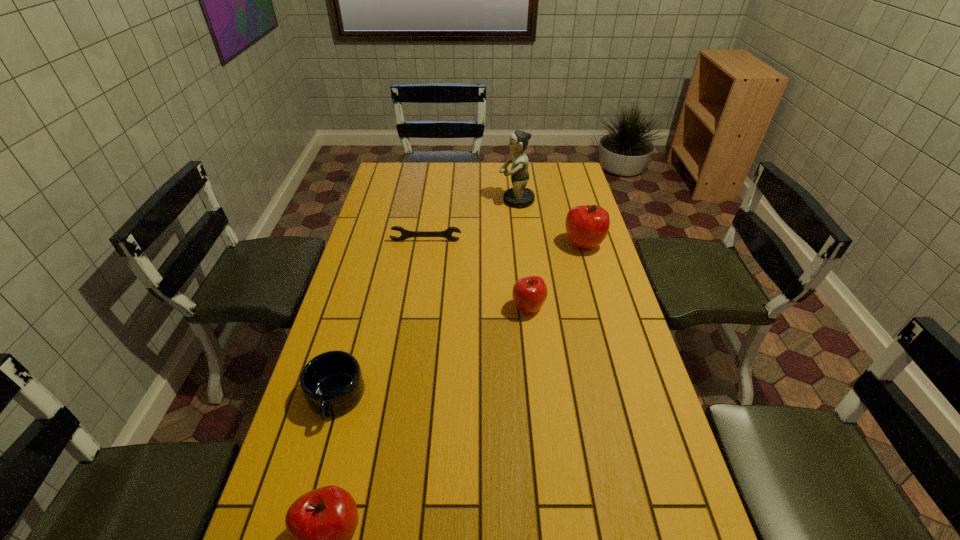
Find the location of `the shortest apple`. the shortest apple is located at coordinates (529, 293).

Locate an element on the screen. the second nearest apple is located at coordinates (529, 293).

Where is `the rightmost object`? the rightmost object is located at coordinates (587, 226).

This screenshot has height=540, width=960. I want to click on the farthest apple, so click(x=587, y=226).

Locate an element on the screen. Image resolution: width=960 pixels, height=540 pixels. the tallest object is located at coordinates (518, 196).

Where is `the farthest object`? The width and height of the screenshot is (960, 540). the farthest object is located at coordinates (518, 196).

This screenshot has height=540, width=960. Find the location of `the second nearest object`. the second nearest object is located at coordinates (332, 383).

Locate an element on the screen. mug is located at coordinates (332, 383).

Identify the location of wrench. The width and height of the screenshot is (960, 540). (405, 234).

Where is `vacant space located on the left of the shortest apple`? Image resolution: width=960 pixels, height=540 pixels. vacant space located on the left of the shortest apple is located at coordinates (444, 308).